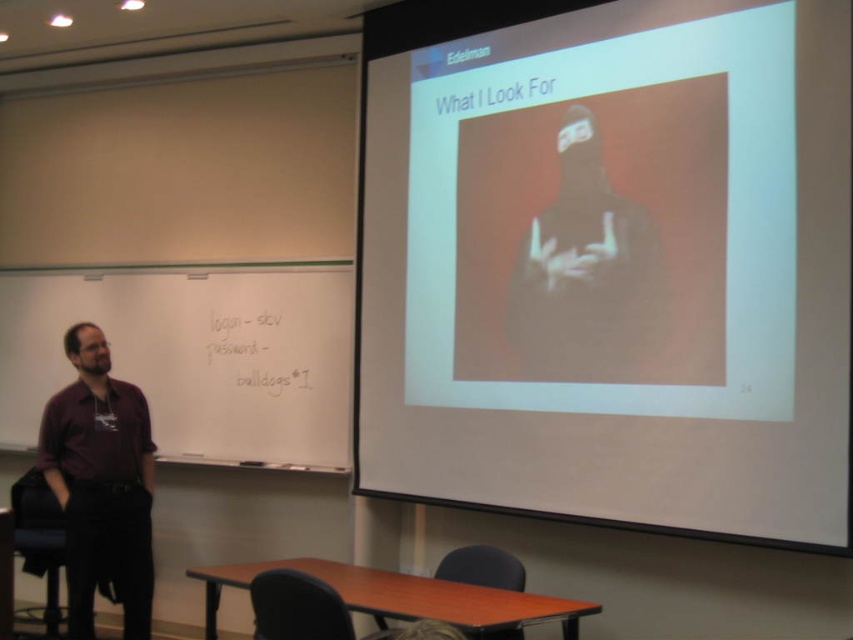
Question: Does maroon shirt at left have a smaller size compared to dark brown leather chair at lower center?

Choices:
 (A) no
 (B) yes

Answer: (A)

Question: Does maroon shirt at left appear under dark brown leather chair at lower center?

Choices:
 (A) yes
 (B) no

Answer: (B)

Question: Which object appears closest to the camera in this image?

Choices:
 (A) handwritten text at whiteboard left
 (B) dark brown leather chair at lower center

Answer: (B)

Question: Which point appears farthest from the camera in this image?

Choices:
 (A) (502, 550)
 (B) (49, 618)
 (C) (74, 637)
 (D) (593, 376)

Answer: (B)

Question: Which point is farther from the camera taking this photo?

Choices:
 (A) (621, 321)
 (B) (57, 474)
 (C) (485, 552)
 (D) (51, 628)

Answer: (D)

Question: Can you confirm if white matte bottle at center is positioned above dark red shirt at left?

Choices:
 (A) no
 (B) yes

Answer: (B)